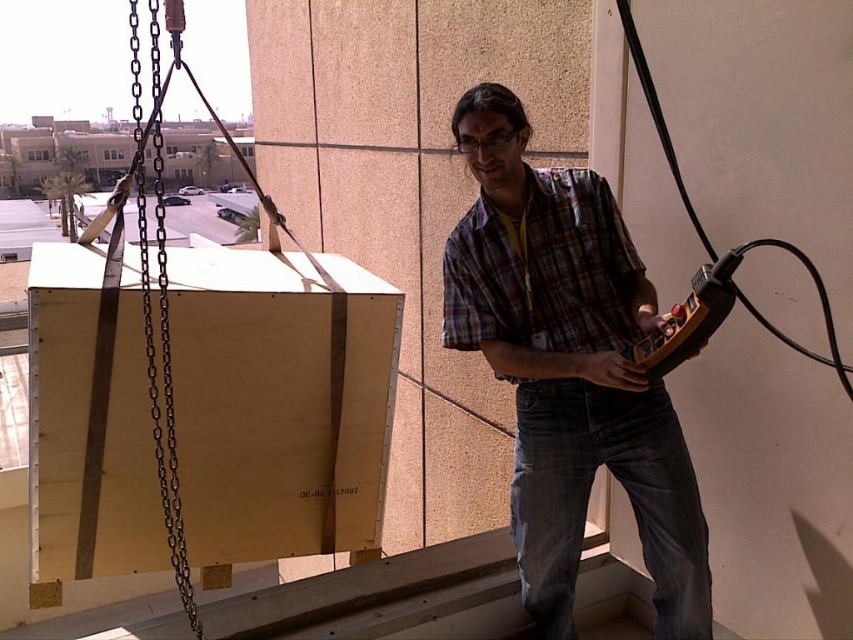
Question: Which point is closer to the camera?

Choices:
 (A) black metal chain at left
 (B) plaid shirt at center

Answer: (A)

Question: Considering the relative positions of plaid shirt at center and black metal chain at left in the image provided, where is plaid shirt at center located with respect to black metal chain at left?

Choices:
 (A) right
 (B) left

Answer: (A)

Question: Does plaid shirt at center come behind black metal chain at left?

Choices:
 (A) no
 (B) yes

Answer: (B)

Question: Is plaid shirt at center wider than black metal chain at left?

Choices:
 (A) no
 (B) yes

Answer: (A)

Question: Which point is closer to the camera?

Choices:
 (A) (167, 301)
 (B) (521, 129)

Answer: (B)